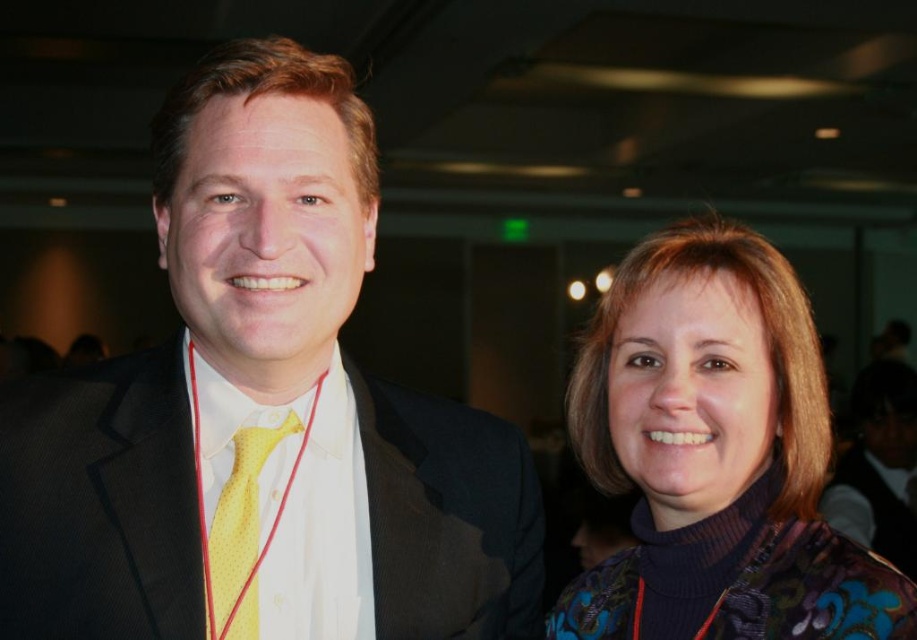
Does matte black suit at left have a larger size compared to yellow dotted tie at center?

Correct, matte black suit at left is larger in size than yellow dotted tie at center.

How far apart are matte black suit at left and yellow dotted tie at center?

matte black suit at left and yellow dotted tie at center are 14.35 centimeters apart.

Is point (379, 630) positioned before point (242, 550)?

No, it is behind (242, 550).

Where is `matte black suit at left`? The height and width of the screenshot is (640, 917). matte black suit at left is located at coordinates (261, 413).

Measure the distance between multicolored floral sweater at right and yellow dotted tie at center.

They are 16.34 inches apart.

Is multicolored floral sweater at right shorter than yellow dotted tie at center?

Incorrect, multicolored floral sweater at right's height does not fall short of yellow dotted tie at center's.

This screenshot has height=640, width=917. In order to click on multicolored floral sweater at right in this screenshot , I will do `click(715, 456)`.

Does matte black suit at left come in front of multicolored floral sweater at right?

No, matte black suit at left is further to the viewer.

Identify the location of matte black suit at left. (261, 413).

Identify the location of matte black suit at left. (261, 413).

Find the location of a particular element. The height and width of the screenshot is (640, 917). matte black suit at left is located at coordinates (261, 413).